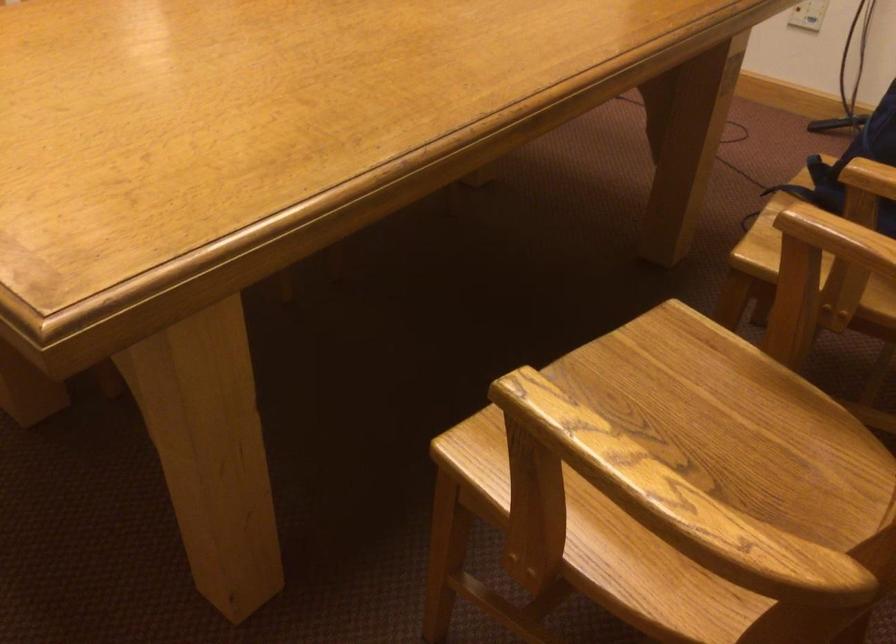
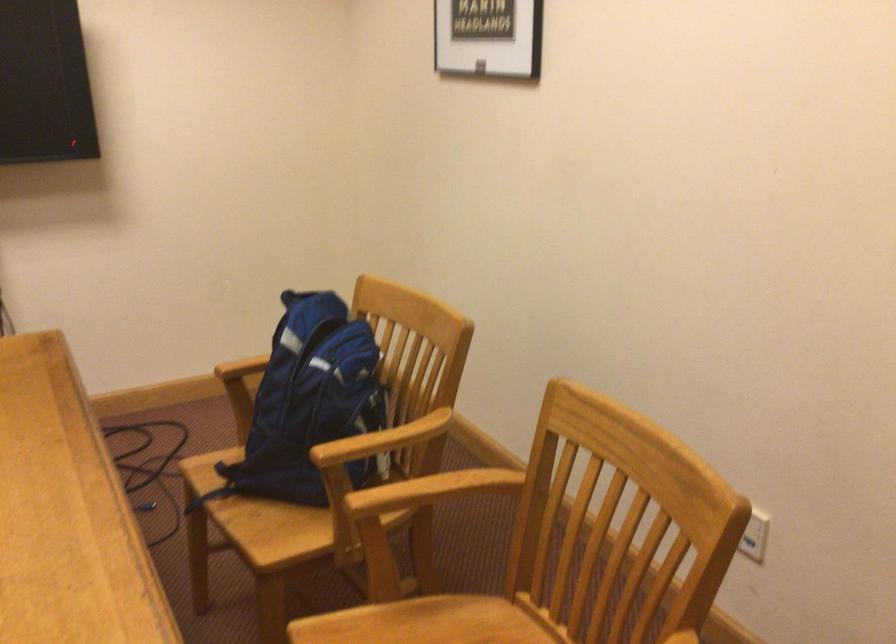
Find the pixel in the second image that matches point 762,397 in the first image.

(415, 627)